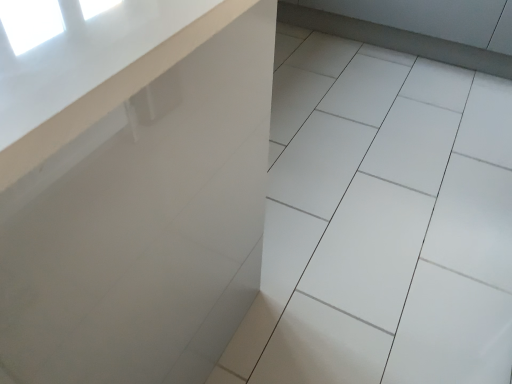
Where is `white glossy tile at center`? This screenshot has width=512, height=384. white glossy tile at center is located at coordinates (381, 222).

What do you see at coordinates (381, 222) in the screenshot?
I see `white glossy tile at center` at bounding box center [381, 222].

In order to face white glossy tile at center, should I rotate leftwards or rightwards?

A 10.027 degree turn to the right will do.

This screenshot has height=384, width=512. What do you see at coordinates (145, 226) in the screenshot? I see `white glossy counter at upper left` at bounding box center [145, 226].

What is the approximate height of white glossy counter at upper left?

36.18 inches.

Find the location of a particular element. This screenshot has height=384, width=512. white glossy counter at upper left is located at coordinates (145, 226).

Find the location of `white glossy tile at center`. white glossy tile at center is located at coordinates (381, 222).

In the image, is white glossy counter at upper left on the left side or the right side of white glossy tile at center?

Clearly, white glossy counter at upper left is on the left of white glossy tile at center in the image.

Does white glossy counter at upper left lie in front of white glossy tile at center?

Answer: Yes.

Is point (47, 232) closer to viewer compared to point (340, 89)?

Yes, point (47, 232) is closer to viewer.

From the image's perspective, which is above, white glossy counter at upper left or white glossy tile at center?

white glossy tile at center.

From a real-world perspective, who is located lower, white glossy counter at upper left or white glossy tile at center?

From a 3D spatial view, white glossy tile at center is below.

Can you confirm if white glossy counter at upper left is wider than white glossy tile at center?

No, white glossy counter at upper left is not wider than white glossy tile at center.

Considering the sizes of objects white glossy counter at upper left and white glossy tile at center in the image provided, who is shorter, white glossy counter at upper left or white glossy tile at center?

white glossy tile at center is shorter.

In the scene shown: Is white glossy counter at upper left bigger than white glossy tile at center?

Yes.

Which is correct: white glossy counter at upper left is inside white glossy tile at center, or outside of it?

white glossy counter at upper left is spatially situated outside white glossy tile at center.

From the picture: Is white glossy counter at upper left placed right next to white glossy tile at center?

No, white glossy counter at upper left is not next to white glossy tile at center.

Is white glossy counter at upper left looking in the opposite direction of white glossy tile at center?

No, white glossy counter at upper left is not facing the opposite direction of white glossy tile at center.

How many degrees apart are the facing directions of white glossy counter at upper left and white glossy tile at center?

The facing directions of white glossy counter at upper left and white glossy tile at center are 89.9 degrees apart.

Find the location of a particular element. The width and height of the screenshot is (512, 384). counter above the white glossy tile at center (from a real-world perspective) is located at coordinates (145, 226).

Is white glossy tile at center at the right side of white glossy counter at upper left?

Yes.

Is the position of white glossy tile at center less distant than that of white glossy counter at upper left?

No, it is not.

Is point (333, 130) farther from viewer compared to point (137, 101)?

Yes, it is.

From the image's perspective, does white glossy tile at center appear higher than white glossy counter at upper left?

Yes, from the image's perspective, white glossy tile at center is over white glossy counter at upper left.

From a real-world perspective, is white glossy tile at center below white glossy counter at upper left?

Yes.

In terms of width, does white glossy tile at center look wider or thinner when compared to white glossy counter at upper left?

Clearly, white glossy tile at center has more width compared to white glossy counter at upper left.

Does white glossy tile at center have a lesser height compared to white glossy counter at upper left?

Yes.

Between white glossy tile at center and white glossy counter at upper left, which one has larger size?

With larger size is white glossy counter at upper left.

Is white glossy counter at upper left completely or partially inside white glossy tile at center?

No, white glossy counter at upper left is located outside of white glossy tile at center.

Looking at this image, is the surface of white glossy tile at center in direct contact with white glossy counter at upper left?

There is a gap between white glossy tile at center and white glossy counter at upper left.

Is white glossy tile at center positioned with its back to white glossy counter at upper left?

No, white glossy tile at center is not facing away from white glossy counter at upper left.

Can you tell me how much white glossy tile at center and white glossy counter at upper left differ in facing direction?

white glossy tile at center and white glossy counter at upper left are facing 89.9 degrees away from each other.

At what (x,y) coordinates should I click in order to perform the action: click on counter below the white glossy tile at center (from the image's perspective). Please return your answer as a coordinate pair (x, y). Image resolution: width=512 pixels, height=384 pixels. Looking at the image, I should click on (145, 226).

The image size is (512, 384). What are the coordinates of `ceramic tile on the right of white glossy counter at upper left` in the screenshot? It's located at (381, 222).

At what (x,y) coordinates should I click in order to perform the action: click on counter in front of the white glossy tile at center. Please return your answer as a coordinate pair (x, y). The image size is (512, 384). Looking at the image, I should click on (145, 226).